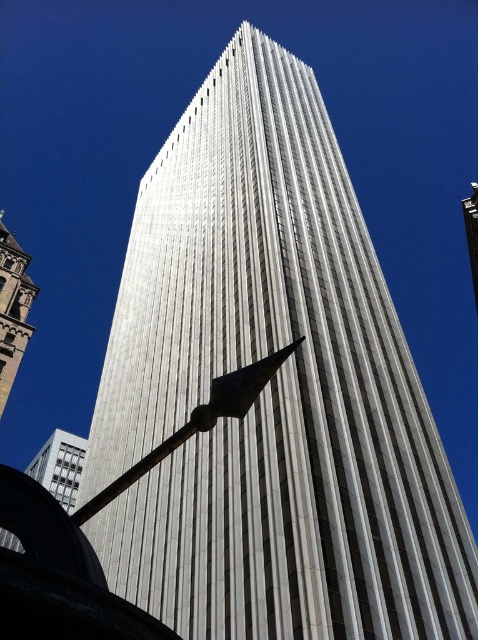
Question: Does metallic polished pole at center lie behind white marble tower at left?

Choices:
 (A) no
 (B) yes

Answer: (A)

Question: Which of the following is the farthest from the observer?

Choices:
 (A) metallic polished pole at center
 (B) white marble tower at left

Answer: (B)

Question: Is metallic polished pole at center further to camera compared to white marble tower at left?

Choices:
 (A) no
 (B) yes

Answer: (A)

Question: Does metallic polished pole at center appear on the left side of white marble tower at left?

Choices:
 (A) yes
 (B) no

Answer: (B)